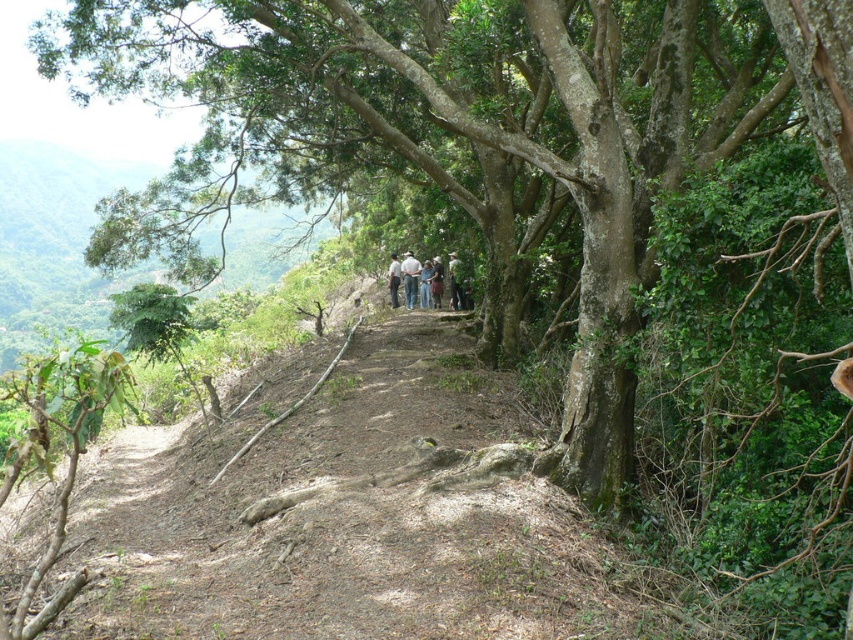
Consider the image. You are a hiker trying to locate two people in the forest. You see a dark gray shirt at center and a light brown leather jacket at center. Which clothing item is higher up in the image?

The dark gray shirt at center is located above the light brown leather jacket at center, so the dark gray shirt at center is higher up in the image.

You are a hiker planning to take a photo of the group wearing the white fabric shirt at center and the light brown leather jacket at center. Which clothing item should you focus on to capture their full height in the photo?

The white fabric shirt at center is much taller than the light brown leather jacket at center, so focusing on the white fabric shirt at center would ensure the full height is captured.

You are a hiker trying to locate your friend wearing a dark gray shirt at center in a forest. The path is bordered by dense vegetation. Based on the coordinates provided, can you determine if your friend is standing on the dirt path or off the path?

The dark gray shirt at center is located at point (422, 280), which is on the dirt path since the coordinates fall within the path area described in the scene.